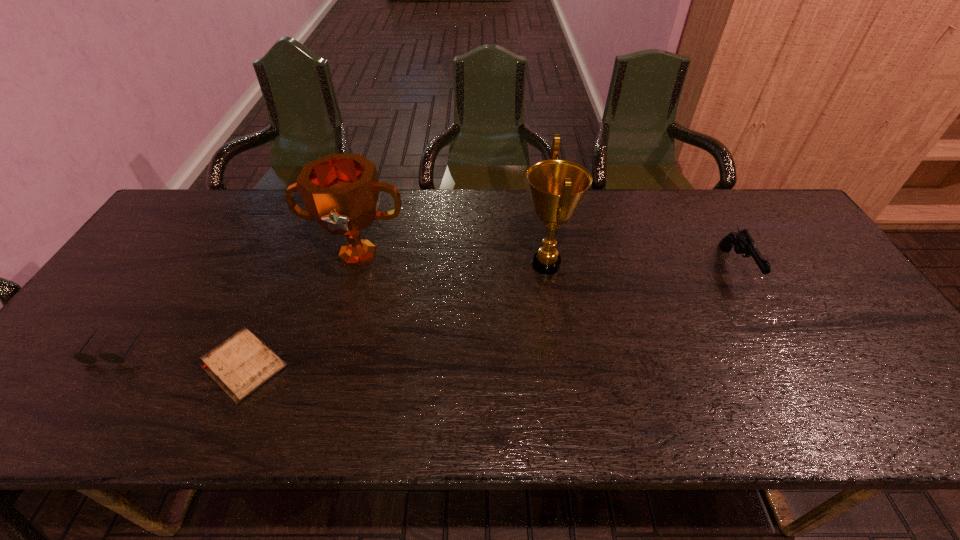
Find the location of a particular element. This screenshot has width=960, height=540. the fourth object from left to right is located at coordinates (557, 187).

The image size is (960, 540). I want to click on the right award, so click(x=557, y=187).

I want to click on the second tallest object, so click(341, 192).

Where is `the shorter award`? The width and height of the screenshot is (960, 540). the shorter award is located at coordinates (341, 192).

Where is `the third shortest object`? The image size is (960, 540). the third shortest object is located at coordinates (743, 243).

This screenshot has height=540, width=960. I want to click on gun, so click(x=743, y=243).

I want to click on the second shortest object, so point(81,357).

At what (x,y) coordinates should I click in order to perform the action: click on sunglasses. Please return your answer as a coordinate pair (x, y). Looking at the image, I should click on (81, 357).

At what (x,y) coordinates should I click in order to perform the action: click on diary. Please return your answer as a coordinate pair (x, y). The width and height of the screenshot is (960, 540). Looking at the image, I should click on 240,365.

Where is `free space located 0.190m on the front view with handles of the tallest object`? The image size is (960, 540). free space located 0.190m on the front view with handles of the tallest object is located at coordinates click(x=452, y=264).